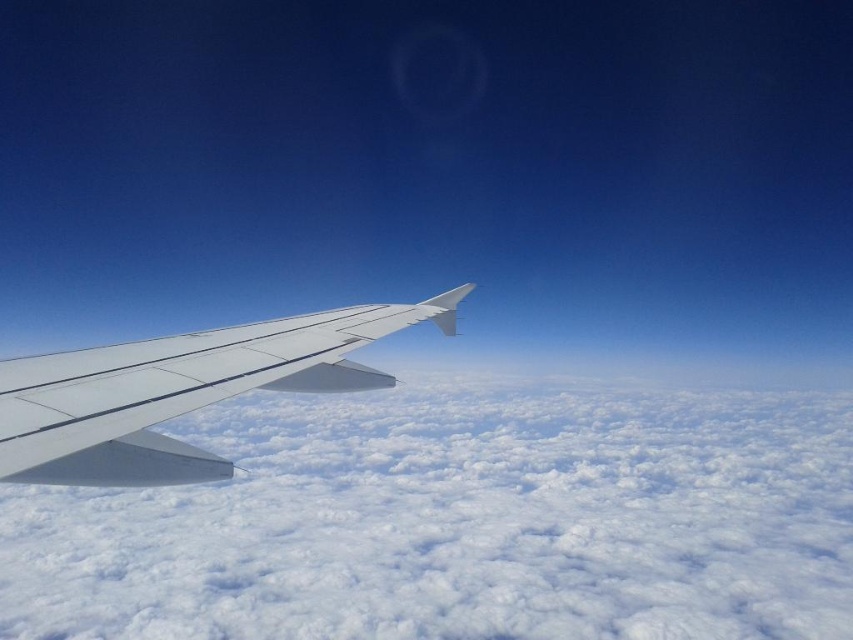
Based on the photo, you are a passenger sitting near the window and notice two points marked on the wing of the airplane. The first point is at coordinates point [320,438] and the second is at point [289,333]. From your seat, which point appears closer to you?

Point [289,333] appears closer because it is in front of point [320,438].

You are a passenger sitting by the window and see the white fluffy cloud at lower left and the white matte wing at lower left. Which object is closer to you?

The white fluffy cloud at lower left is positioned under the white matte wing at lower left, so the white fluffy cloud at lower left is closer to you.